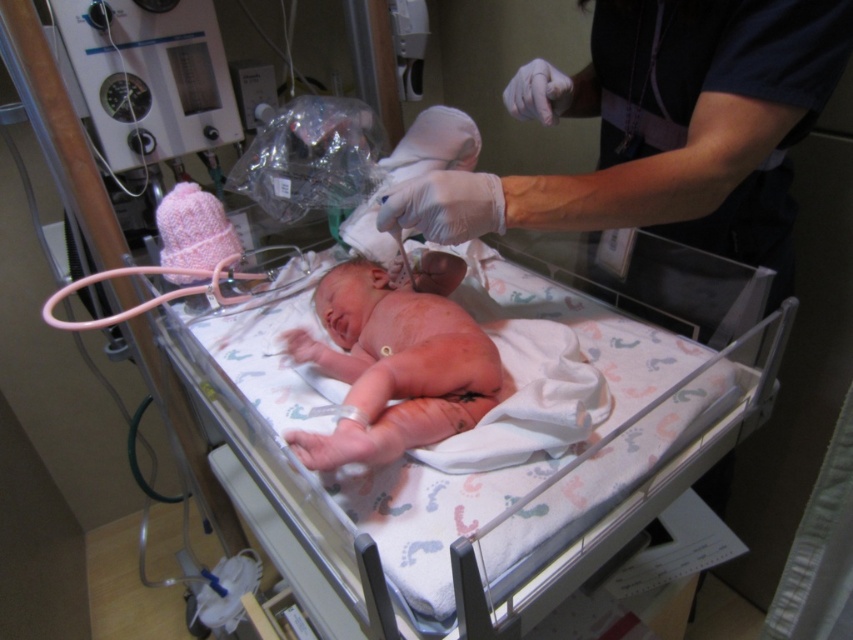
Who is more distant from viewer, (x=844, y=10) or (x=399, y=422)?

The point (x=399, y=422) is behind.

Between white latex gloves at upper center and pink fabric newborn at center, which one is positioned lower?

pink fabric newborn at center

This screenshot has width=853, height=640. I want to click on white latex gloves at upper center, so click(x=664, y=131).